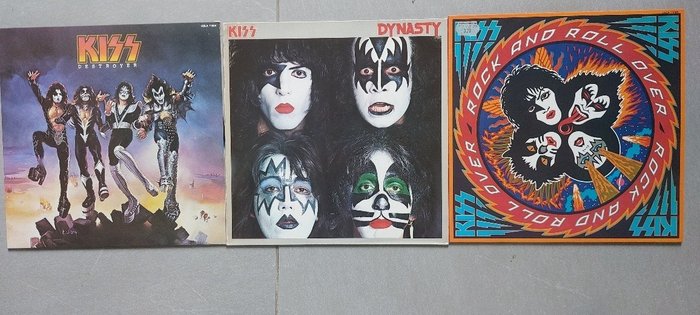
You are a GUI agent. You are given a task and a screenshot of the screen. Output one action in this format:
    pyautogui.click(x=<x>, y=<y>)
    Task: Click on the grey wall
    
    Given the screenshot: What is the action you would take?
    pos(652,295)